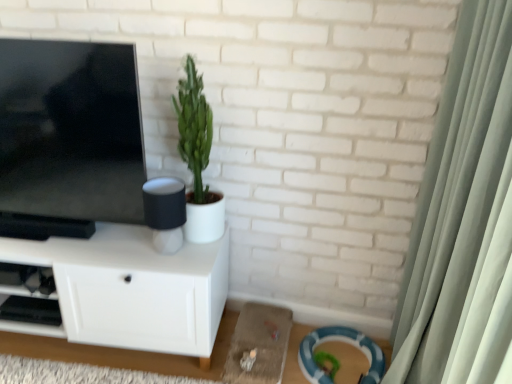
Find the location of a particular element. The image size is (512, 384). black plastic shelf at lower left is located at coordinates (29, 301).

What do you see at coordinates (165, 212) in the screenshot? I see `matte black speaker at center` at bounding box center [165, 212].

Identify the location of black plastic shelf at lower left. The image size is (512, 384). (29, 301).

Can you confirm if black plastic shelf at lower left is shorter than white matte cabinet at left?

Yes, black plastic shelf at lower left is shorter than white matte cabinet at left.

From a real-world perspective, who is located lower, black plastic shelf at lower left or white matte cabinet at left?

black plastic shelf at lower left, from a real-world perspective.

How distant is black plastic shelf at lower left from white matte cabinet at left?

black plastic shelf at lower left is 8.74 inches from white matte cabinet at left.

How many degrees apart are the facing directions of black plastic shelf at lower left and white matte cabinet at left?

1.74 degrees separate the facing orientations of black plastic shelf at lower left and white matte cabinet at left.

Is white matte cabinet at left oriented away from matte black speaker at center?

white matte cabinet at left does not have its back to matte black speaker at center.

Which is more to the right, white matte cabinet at left or matte black speaker at center?

matte black speaker at center is more to the right.

Is white matte cabinet at left wider or thinner than matte black speaker at center?

Considering their sizes, white matte cabinet at left looks broader than matte black speaker at center.

Which is correct: white matte cabinet at left is inside matte black speaker at center, or outside of it?

The correct answer is: outside.

Which is more to the left, light green fabric curtain at right or white matte cabinet at left?

Positioned to the left is white matte cabinet at left.

Are light green fabric curtain at right and white matte cabinet at left making contact?

No, light green fabric curtain at right is not beside white matte cabinet at left.

Find the location of a particular element. Image resolution: width=512 pixels, height=384 pixels. cabinetry below the light green fabric curtain at right (from the image's perspective) is located at coordinates (134, 289).

Considering the points (475, 357) and (218, 270), which point is behind, point (475, 357) or point (218, 270)?

The point (218, 270) is farther.

Does green matte plant at center appear on the right side of black plastic shelf at lower left?

Correct, you'll find green matte plant at center to the right of black plastic shelf at lower left.

How much distance is there between green matte plant at center and black plastic shelf at lower left?

green matte plant at center and black plastic shelf at lower left are 73.01 centimeters apart.

Which of these two, green matte plant at center or black plastic shelf at lower left, is wider?

Wider between the two is black plastic shelf at lower left.

Is green matte plant at center positioned in front of black plastic shelf at lower left?

Yes, green matte plant at center is closer to the viewer.

Is there a large distance between matte black tv at left and black plastic shelf at lower left?

No, matte black tv at left is in close proximity to black plastic shelf at lower left.

Could black plastic shelf at lower left be considered to be inside matte black tv at left?

Actually, black plastic shelf at lower left is outside matte black tv at left.

Considering the positions of objects matte black tv at left and black plastic shelf at lower left in the image provided, who is more to the right, matte black tv at left or black plastic shelf at lower left?

matte black tv at left is more to the right.

Between matte black tv at left and black plastic shelf at lower left, which one has less height?

black plastic shelf at lower left is shorter.

Could you tell me if black plastic shelf at lower left is facing green matte plant at center?

No.

Looking at this image, which is correct: black plastic shelf at lower left is inside green matte plant at center, or outside of it?

black plastic shelf at lower left is outside green matte plant at center.

Find the location of `shelf below the green matte plant at center (from a real-world perspective)`. shelf below the green matte plant at center (from a real-world perspective) is located at coordinates (29, 301).

From a real-world perspective, relative to green matte plant at center, is black plastic shelf at lower left vertically above or below?

black plastic shelf at lower left is below green matte plant at center.

From the image's perspective, which is below, light green fabric curtain at right or matte black speaker at center?

light green fabric curtain at right is shown below in the image.

Which is in front, light green fabric curtain at right or matte black speaker at center?

light green fabric curtain at right is more forward.

Considering the points (509, 319) and (157, 227), which point is behind, point (509, 319) or point (157, 227)?

The point (157, 227) is farther.

Identify the location of shelf on the left of white matte cabinet at left. The image size is (512, 384). (29, 301).

Identify the location of speaker on the right of the white matte cabinet at left. The height and width of the screenshot is (384, 512). (165, 212).

Looking at the image, which one is located closer to matte black speaker at center, black plastic shelf at lower left or matte black tv at left?

matte black tv at left.

Which object lies nearer to the anchor point white matte cabinet at left, light green fabric curtain at right or matte black speaker at center?

The object closer to white matte cabinet at left is matte black speaker at center.

Which object lies further to the anchor point white matte cabinet at left, matte black speaker at center or light green fabric curtain at right?

light green fabric curtain at right is further to white matte cabinet at left.

When comparing their distances from matte black tv at left, does black plastic shelf at lower left or matte black speaker at center seem further?

black plastic shelf at lower left is positioned further to the anchor matte black tv at left.

In the scene shown: When comparing their distances from matte black speaker at center, does light green fabric curtain at right or white matte cabinet at left seem further?

light green fabric curtain at right is further to matte black speaker at center.

Based on their spatial positions, is green matte plant at center or light green fabric curtain at right closer to black plastic shelf at lower left?

green matte plant at center is positioned closer to the anchor black plastic shelf at lower left.

When comparing their distances from white matte cabinet at left, does matte black tv at left or matte black speaker at center seem further?

matte black tv at left lies further to white matte cabinet at left than the other object.

Considering their positions, is light green fabric curtain at right positioned closer to matte black tv at left than white matte cabinet at left?

white matte cabinet at left.

Where is `speaker between black plastic shelf at lower left and light green fabric curtain at right in the horizontal direction`? The image size is (512, 384). speaker between black plastic shelf at lower left and light green fabric curtain at right in the horizontal direction is located at coordinates (165, 212).

Image resolution: width=512 pixels, height=384 pixels. I want to click on speaker located between black plastic shelf at lower left and green matte plant at center in the left-right direction, so click(x=165, y=212).

This screenshot has height=384, width=512. In order to click on television situated between black plastic shelf at lower left and green matte plant at center from left to right in this screenshot , I will do tap(69, 138).

Where is `speaker between matte black tv at left and black plastic shelf at lower left vertically`? The height and width of the screenshot is (384, 512). speaker between matte black tv at left and black plastic shelf at lower left vertically is located at coordinates (165, 212).